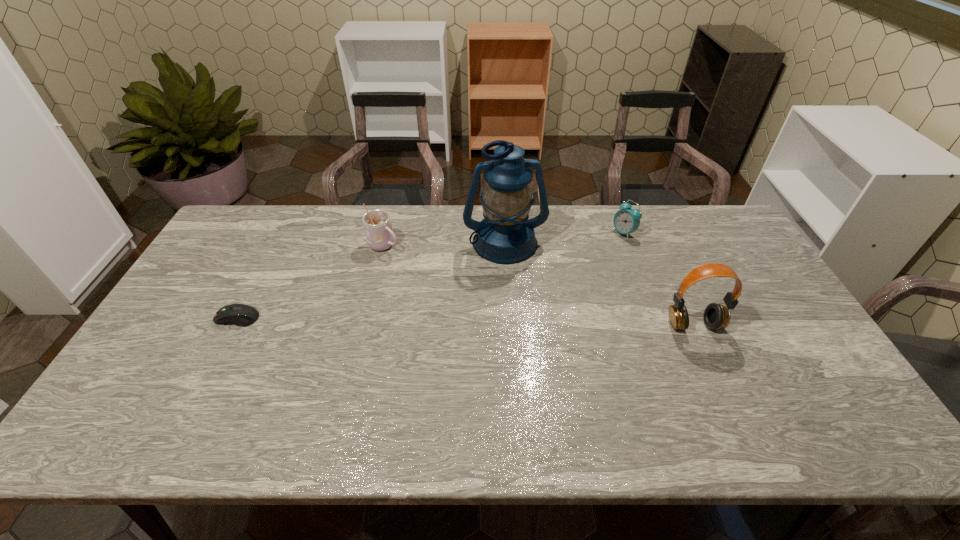
The height and width of the screenshot is (540, 960). In order to click on free area in between the leftmost object and the third object from right to left in this screenshot , I will do click(x=372, y=280).

Find the location of a particular element. The height and width of the screenshot is (540, 960). free point between the headset and the shortest object is located at coordinates (466, 321).

Where is `empty space between the tallest object and the third tallest object`? This screenshot has width=960, height=540. empty space between the tallest object and the third tallest object is located at coordinates pyautogui.click(x=444, y=244).

At what (x,y) coordinates should I click in order to perform the action: click on unoccupied position between the fourth tallest object and the lantern. Please return your answer as a coordinate pair (x, y). The height and width of the screenshot is (540, 960). Looking at the image, I should click on (564, 238).

This screenshot has width=960, height=540. I want to click on free point between the fourth tallest object and the tallest object, so click(x=564, y=238).

I want to click on vacant space in between the fourth object from right to left and the computer equipment, so pos(311,282).

Find the location of a particular element. free point between the third shortest object and the lantern is located at coordinates (444, 244).

I want to click on unoccupied position between the leftmost object and the fourth object from right to left, so click(x=311, y=282).

You are a GUI agent. You are given a task and a screenshot of the screen. Output one action in this format:
    pyautogui.click(x=<x>, y=<y>)
    Task: Click on the empty space between the alarm clock and the fourth shortest object
    Image resolution: width=960 pixels, height=540 pixels.
    Given the screenshot: What is the action you would take?
    659,279

Locate which object ranks third in proximity to the tallest object. Please provide its 2D coordinates. Your answer should be formatted as a tuple, i.e. [(x, y)], where the tuple contains the x and y coordinates of a point satisfying the conditions above.

[(716, 316)]